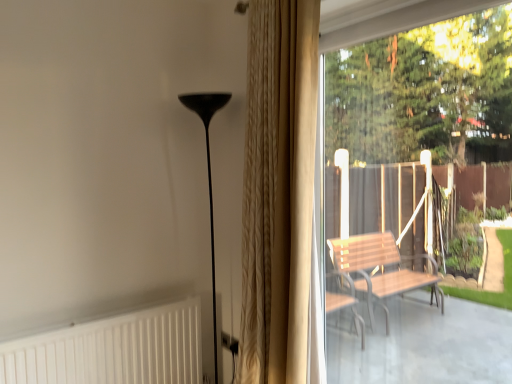
Question: Is matte black floor lamp at center at the left side of beige textured curtain at center?

Choices:
 (A) no
 (B) yes

Answer: (B)

Question: Are matte black floor lamp at center and beige textured curtain at center beside each other?

Choices:
 (A) no
 (B) yes

Answer: (A)

Question: Is matte black floor lamp at center facing towards beige textured curtain at center?

Choices:
 (A) no
 (B) yes

Answer: (A)

Question: From a real-world perspective, is matte black floor lamp at center located higher than beige textured curtain at center?

Choices:
 (A) no
 (B) yes

Answer: (A)

Question: Does matte black floor lamp at center have a greater height compared to beige textured curtain at center?

Choices:
 (A) no
 (B) yes

Answer: (A)

Question: Is point pos(202,109) closer or farther from the camera than point pos(106,322)?

Choices:
 (A) farther
 (B) closer

Answer: (A)

Question: From a real-world perspective, is matte black floor lamp at center physically located above or below white textured radiator at lower left?

Choices:
 (A) below
 (B) above

Answer: (B)

Question: Is matte black floor lamp at center bigger or smaller than white textured radiator at lower left?

Choices:
 (A) big
 (B) small

Answer: (A)

Question: Do you think matte black floor lamp at center is within white textured radiator at lower left, or outside of it?

Choices:
 (A) outside
 (B) inside

Answer: (A)

Question: From a real-world perspective, is wooden bench at right positioned above or below matte black floor lamp at center?

Choices:
 (A) below
 (B) above

Answer: (B)

Question: Is wooden bench at right wider or thinner than matte black floor lamp at center?

Choices:
 (A) thin
 (B) wide

Answer: (A)

Question: In the image, is wooden bench at right on the left side or the right side of matte black floor lamp at center?

Choices:
 (A) right
 (B) left

Answer: (A)

Question: In the image, is wooden bench at right positioned in front of or behind matte black floor lamp at center?

Choices:
 (A) front
 (B) behind

Answer: (A)

Question: Is matte black floor lamp at center taller or shorter than beige textured curtain at center?

Choices:
 (A) tall
 (B) short

Answer: (B)

Question: In the image, is matte black floor lamp at center positioned in front of or behind beige textured curtain at center?

Choices:
 (A) behind
 (B) front

Answer: (A)